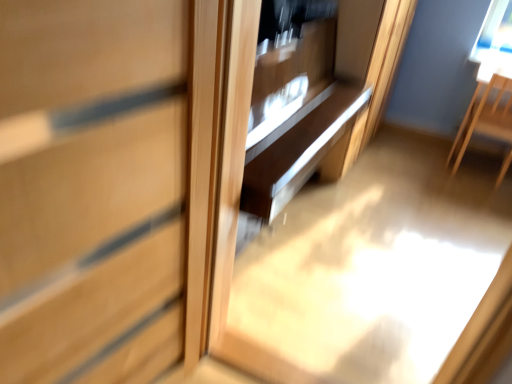
Describe the element at coordinates (485, 117) in the screenshot. I see `wooden chair at right` at that location.

Where is `wooden chair at right`? Image resolution: width=512 pixels, height=384 pixels. wooden chair at right is located at coordinates (485, 117).

Find the location of a particular element. wooden chair at right is located at coordinates (485, 117).